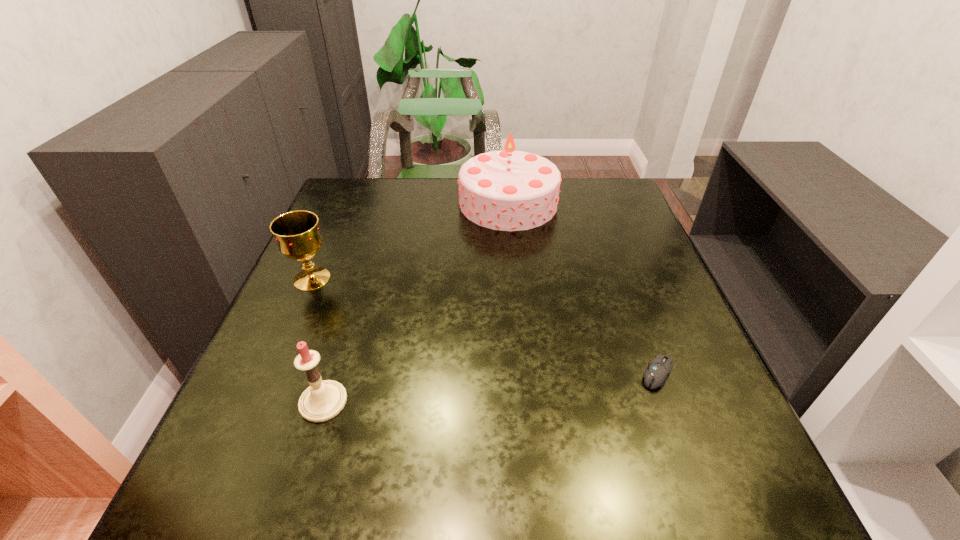
The image size is (960, 540). What are the coordinates of `vacant area that lies between the computer mouse and the candle` in the screenshot? It's located at (491, 387).

Find the location of a particular element. free spot between the rightmost object and the birthday cake is located at coordinates (584, 288).

The height and width of the screenshot is (540, 960). What are the coordinates of `free space between the third object from right to left and the chalice` in the screenshot? It's located at (318, 340).

This screenshot has width=960, height=540. Identify the location of unoccupied position between the rightmost object and the third nearest object. pos(485,326).

Locate an element on the screen. unoccupied position between the second object from left to right and the leftmost object is located at coordinates (318, 340).

This screenshot has height=540, width=960. What are the coordinates of `free space between the computer mouse and the birthday cake` in the screenshot? It's located at (584, 288).

Locate an element on the screen. unoccupied position between the shortest object and the chalice is located at coordinates (485, 326).

You are a GUI agent. You are given a task and a screenshot of the screen. Output one action in this format:
    pyautogui.click(x=<x>, y=<y>)
    Task: Click on the unoccupied position between the candle and the tallest object
    This screenshot has width=960, height=540.
    Given the screenshot: What is the action you would take?
    pyautogui.click(x=416, y=302)

At what (x,y) coordinates should I click in order to perform the action: click on blank region between the computer mouse and the tallest object. Please return your answer as a coordinate pair (x, y). Looking at the image, I should click on (584, 288).

Locate an element on the screen. object that stands as the second closest to the leftmost object is located at coordinates pos(508,190).